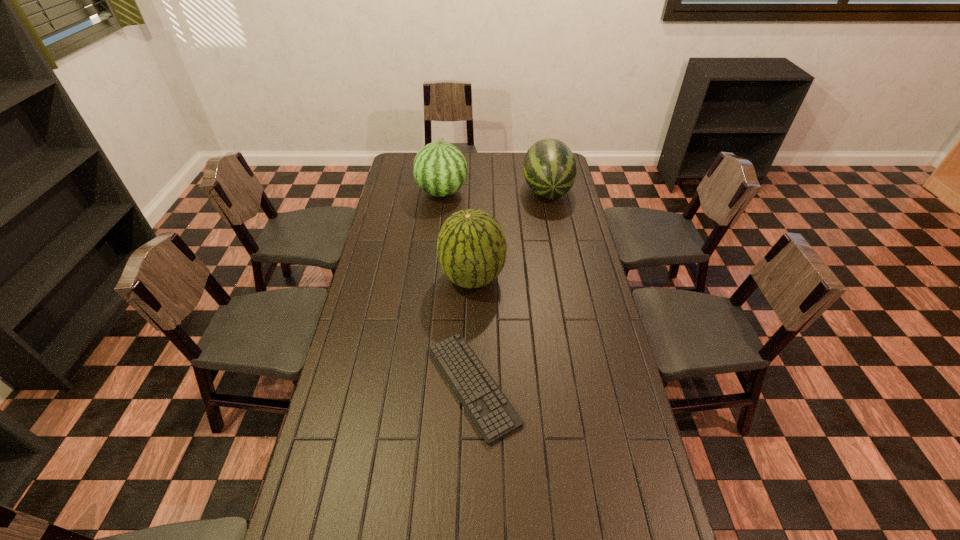
This screenshot has width=960, height=540. I want to click on object that is the third closest to the nearest watermelon, so click(549, 168).

Where is `watermelon that stands as the second closest to the shortest watermelon`? The height and width of the screenshot is (540, 960). watermelon that stands as the second closest to the shortest watermelon is located at coordinates (471, 247).

Identify which watermelon is the second closest to the third farthest object. Please provide its 2D coordinates. Your answer should be formatted as a tuple, i.e. [(x, y)], where the tuple contains the x and y coordinates of a point satisfying the conditions above.

[(549, 168)]

The image size is (960, 540). In order to click on vacant area in the image that satisfies the following two spatial constraints: 1. on the front side of the second nearest object; 2. on the left side of the nearest object in this screenshot , I will do `click(470, 385)`.